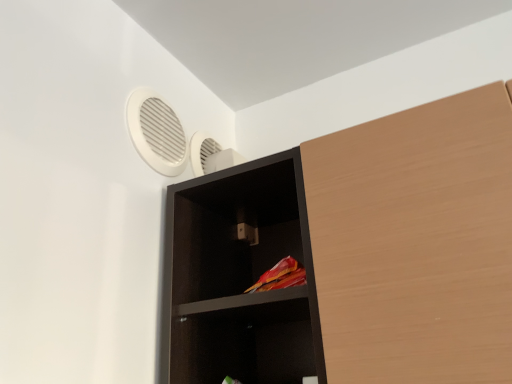
Describe the element at coordinates (156, 132) in the screenshot. Image resolution: width=512 pixels, height=384 pixels. I see `white plastic fan at upper left` at that location.

Identify the location of white plastic fan at upper left. (156, 132).

The image size is (512, 384). What do you see at coordinates (240, 277) in the screenshot?
I see `black matte shelf at center` at bounding box center [240, 277].

Identify the location of black matte shelf at center. (240, 277).

Measure the distance between black matte shelf at center and camera.

They are 22.07 inches apart.

At what (x,y) coordinates should I click in order to perform the action: click on white plastic fan at upper left. Please return your answer as a coordinate pair (x, y). The width and height of the screenshot is (512, 384). Looking at the image, I should click on (156, 132).

From the picture: Visually, is white plastic fan at upper left positioned to the left or to the right of black matte shelf at center?

From the image, it's evident that white plastic fan at upper left is to the left of black matte shelf at center.

Which object is closer to the camera taking this photo, white plastic fan at upper left or black matte shelf at center?

Positioned in front is black matte shelf at center.

Is point (136, 95) farther from camera compared to point (210, 275)?

No, (136, 95) is closer to viewer.

From the image's perspective, does white plastic fan at upper left appear higher than black matte shelf at center?

Yes.

From a real-world perspective, between white plastic fan at upper left and black matte shelf at center, who is vertically higher?

white plastic fan at upper left.

Considering the relative sizes of white plastic fan at upper left and black matte shelf at center in the image provided, is white plastic fan at upper left thinner than black matte shelf at center?

Correct, the width of white plastic fan at upper left is less than that of black matte shelf at center.

Is white plastic fan at upper left taller or shorter than black matte shelf at center?

Considering their sizes, white plastic fan at upper left has less height than black matte shelf at center.

Who is smaller, white plastic fan at upper left or black matte shelf at center?

Smaller between the two is white plastic fan at upper left.

Would you say white plastic fan at upper left is inside or outside black matte shelf at center?

white plastic fan at upper left is located beyond the bounds of black matte shelf at center.

Is white plastic fan at upper left positioned far away from black matte shelf at center?

No, white plastic fan at upper left is not far away from black matte shelf at center.

Is white plastic fan at upper left facing towards black matte shelf at center?

No.

What's the angular difference between white plastic fan at upper left and black matte shelf at center's facing directions?

88.5 degrees separate the facing orientations of white plastic fan at upper left and black matte shelf at center.

How distant is white plastic fan at upper left from black matte shelf at center?

white plastic fan at upper left and black matte shelf at center are 10.08 inches apart from each other.

Where is `fan that is above the black matte shelf at center (from a real-world perspective)`? fan that is above the black matte shelf at center (from a real-world perspective) is located at coordinates (156, 132).

Which object is positioned more to the left, black matte shelf at center or white plastic fan at upper left?

Positioned to the left is white plastic fan at upper left.

Which object is further away from the camera, black matte shelf at center or white plastic fan at upper left?

white plastic fan at upper left is behind.

Is point (300, 367) closer to viewer compared to point (151, 164)?

That is False.

From the image's perspective, is black matte shelf at center positioned above or below white plastic fan at upper left?

Clearly, from the image's perspective, black matte shelf at center is below white plastic fan at upper left.

From a real-world perspective, between black matte shelf at center and white plastic fan at upper left, who is vertically higher?

From a 3D spatial view, white plastic fan at upper left is above.

Which of these two, black matte shelf at center or white plastic fan at upper left, is thinner?

white plastic fan at upper left is thinner.

Can you confirm if black matte shelf at center is taller than white plastic fan at upper left?

Indeed, black matte shelf at center has a greater height compared to white plastic fan at upper left.

Which of these two, black matte shelf at center or white plastic fan at upper left, is bigger?

black matte shelf at center.

Is black matte shelf at center not inside white plastic fan at upper left?

black matte shelf at center is positioned outside white plastic fan at upper left.

Is black matte shelf at center placed right next to white plastic fan at upper left?

No, black matte shelf at center is not in contact with white plastic fan at upper left.

Is black matte shelf at center facing away from white plastic fan at upper left?

No.

How much distance is there between black matte shelf at center and white plastic fan at upper left?

A distance of 10.08 inches exists between black matte shelf at center and white plastic fan at upper left.

This screenshot has width=512, height=384. What are the coordinates of `fan lying above the black matte shelf at center (from the image's perspective)` in the screenshot? It's located at (156, 132).

In the image, there is a white plastic fan at upper left. At what (x,y) coordinates should I click in order to perform the action: click on shelf below it (from the image's perspective). Please return your answer as a coordinate pair (x, y). This screenshot has width=512, height=384. Looking at the image, I should click on (240, 277).

The width and height of the screenshot is (512, 384). I want to click on fan on the left of the black matte shelf at center, so click(x=156, y=132).